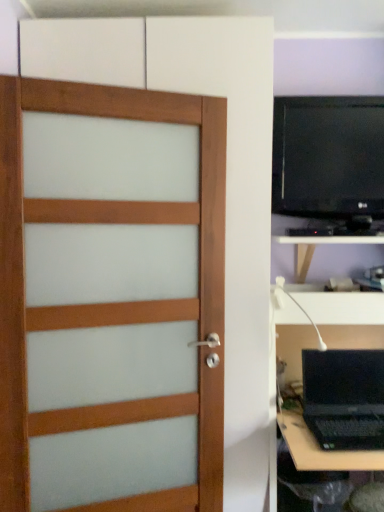
Question: Is white matte tv cabinet at lower right at the right side of satin wood door at left?

Choices:
 (A) no
 (B) yes

Answer: (B)

Question: Does white matte tv cabinet at lower right come behind satin wood door at left?

Choices:
 (A) no
 (B) yes

Answer: (B)

Question: From a real-world perspective, is white matte tv cabinet at lower right located beneath satin wood door at left?

Choices:
 (A) no
 (B) yes

Answer: (A)

Question: Is white matte tv cabinet at lower right turned away from satin wood door at left?

Choices:
 (A) no
 (B) yes

Answer: (A)

Question: From the image's perspective, is white matte tv cabinet at lower right over satin wood door at left?

Choices:
 (A) yes
 (B) no

Answer: (A)

Question: From a real-world perspective, is satin wood door at left positioned above or below white plastic lamp at right?

Choices:
 (A) above
 (B) below

Answer: (B)

Question: Based on their positions, is satin wood door at left located to the left or right of white plastic lamp at right?

Choices:
 (A) left
 (B) right

Answer: (A)

Question: Is satin wood door at left in front of or behind white plastic lamp at right in the image?

Choices:
 (A) behind
 (B) front

Answer: (B)

Question: Is satin wood door at left wider or thinner than white plastic lamp at right?

Choices:
 (A) thin
 (B) wide

Answer: (A)

Question: Is point (370, 132) positioned closer to the camera than point (148, 206)?

Choices:
 (A) farther
 (B) closer

Answer: (A)

Question: Considering the positions of black glossy monitor at upper right and satin wood door at left in the image, is black glossy monitor at upper right wider or thinner than satin wood door at left?

Choices:
 (A) wide
 (B) thin

Answer: (B)

Question: Considering the positions of black glossy monitor at upper right and satin wood door at left in the image, is black glossy monitor at upper right taller or shorter than satin wood door at left?

Choices:
 (A) short
 (B) tall

Answer: (A)

Question: From a real-world perspective, is black glossy monitor at upper right positioned above or below satin wood door at left?

Choices:
 (A) below
 (B) above

Answer: (B)

Question: Is point (182, 488) positioned closer to the camera than point (380, 192)?

Choices:
 (A) closer
 (B) farther

Answer: (A)

Question: Looking at their shapes, would you say satin wood door at left is wider or thinner than black plastic entertainment center at right?

Choices:
 (A) wide
 (B) thin

Answer: (B)